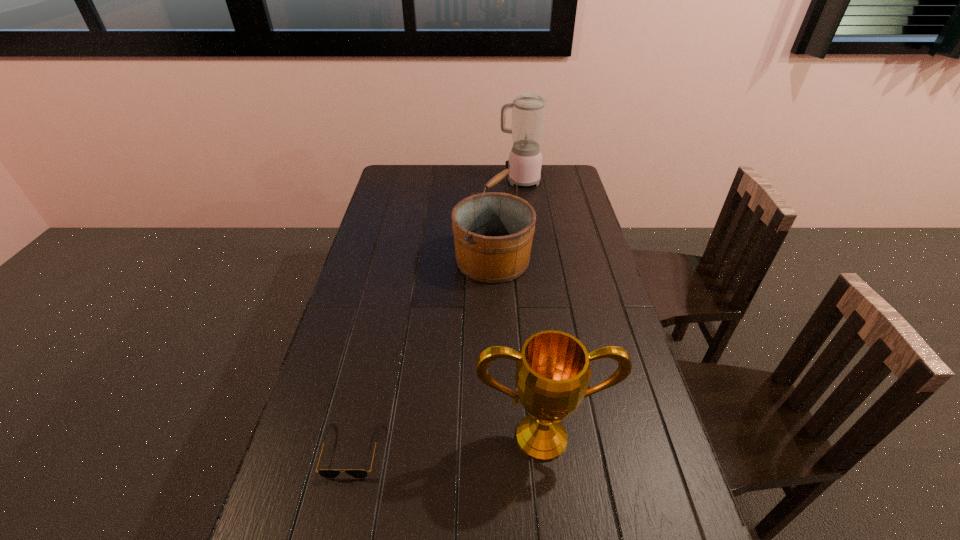
Where is `free point between the leftmost object and the food processor`? Image resolution: width=960 pixels, height=540 pixels. free point between the leftmost object and the food processor is located at coordinates (436, 315).

This screenshot has width=960, height=540. What are the coordinates of `empty space between the shortest object and the farthest object` in the screenshot? It's located at (436, 315).

Find the location of `the closest object to the food processor`. the closest object to the food processor is located at coordinates (493, 231).

Choose which object is the third nearest neighbor to the award. Please provide its 2D coordinates. Your answer should be formatted as a tuple, i.e. [(x, y)], where the tuple contains the x and y coordinates of a point satisfying the conditions above.

[(528, 109)]

The width and height of the screenshot is (960, 540). What are the coordinates of `free spot that satisfies the following two spatial constraints: 1. on the base of the farthest object near the control knob; 2. on the front-facing side of the shortest object` in the screenshot? It's located at (557, 450).

This screenshot has width=960, height=540. In order to click on vacant space that satisfies the following two spatial constraints: 1. on the base of the farthest object near the control knob; 2. on the front-facing side of the shortest object in this screenshot , I will do `click(557, 450)`.